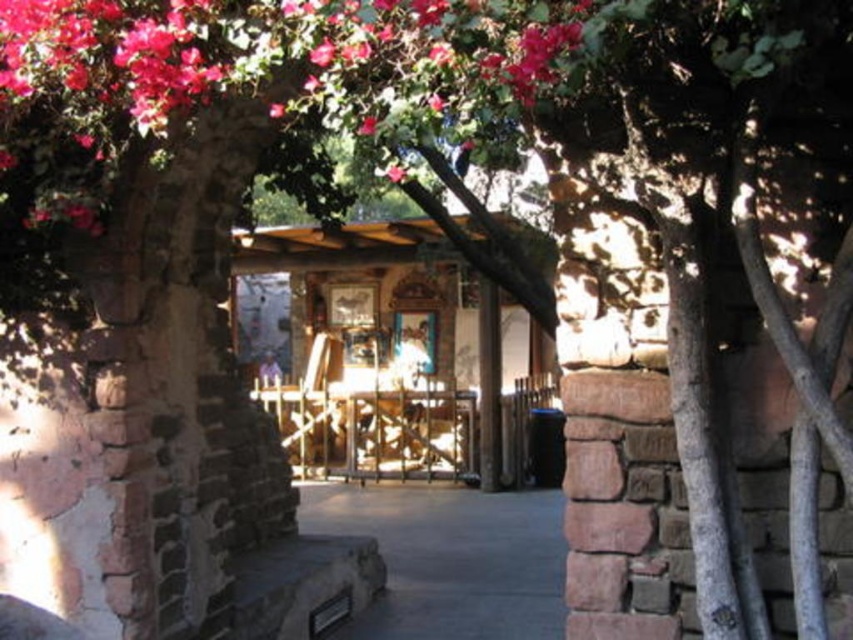
You are standing in front of the rustic stone archway and want to take a photo that includes both point (x=97, y=120) and point (x=434, y=588). Since one is closer to you than the other, which point should you focus on to ensure both are in clear focus?

You should focus on point (x=97, y=120) because it is closer to the camera than point (x=434, y=588). By focusing on the closer point, the farther point will still be within the depth of field and remain in focus.

You are a landscape architect designing a pathway. You need to place a decorative fountain between the vibrant pink petals at upper center and the gray concrete pavement at center. What is the minimum length the fountain should be to span the gap between them?

The distance between the vibrant pink petals at upper center and the gray concrete pavement at center is 6.75 meters, so the fountain should be at least 6.75 meters long to span the gap between them.

You are standing in front of the rustic stone archway and notice vibrant pink petals at upper center. Based on their position, can you estimate where they are located relative to the archway?

The vibrant pink petals at upper center are located at point coordinates of 0.095 on the x axis and 0.339 on the y axis relative to the archway.